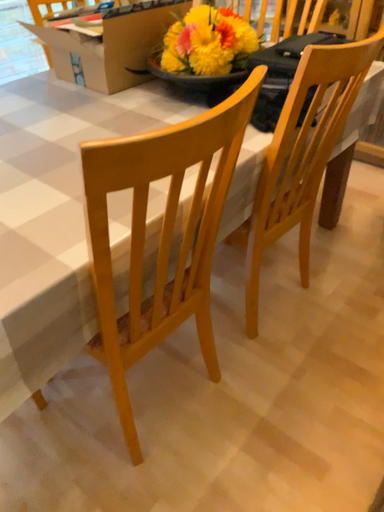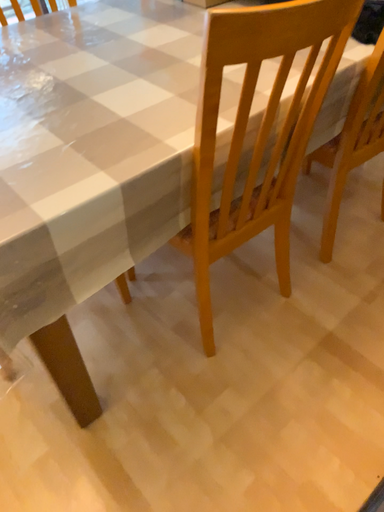
Question: How did the camera likely rotate when shooting the video?

Choices:
 (A) rotated right
 (B) rotated left

Answer: (B)